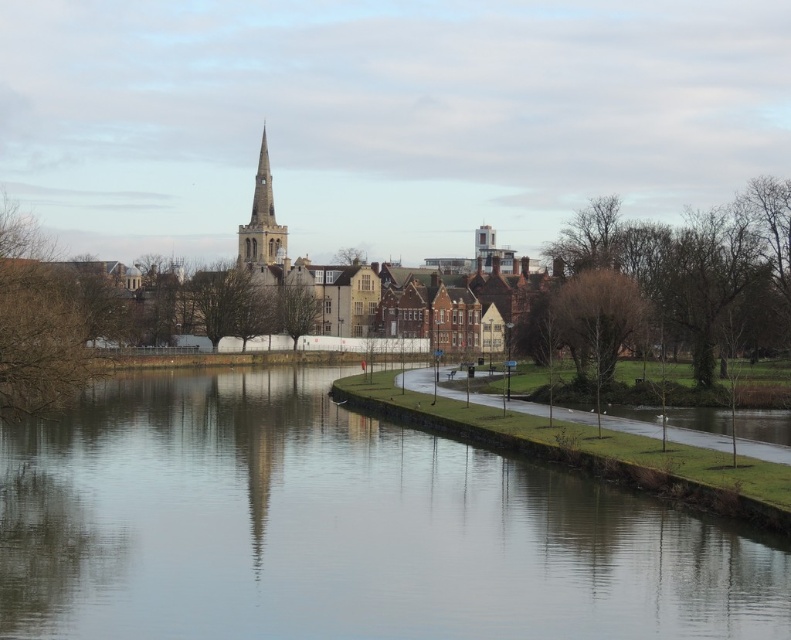
You are standing on the grassy embankment on the right side of the river. You see a point marked at coordinates point (47, 321). Where is this point located?

The point (47, 321) is located on the brown leafless tree at left.

You are a photographer planning to capture the entire riverside scene in one shot. Given that your camera can only capture a width of 10 meters, and knowing the smooth water at center and the bare wood trees at right are both within the frame, which object will require you to adjust your camera angle to ensure it fits entirely within the shot?

The smooth water at center has a greater width than the bare wood trees at right, so you will need to adjust your camera angle to accommodate the wider smooth water at center to ensure it fits within the 10 meter width constraint.